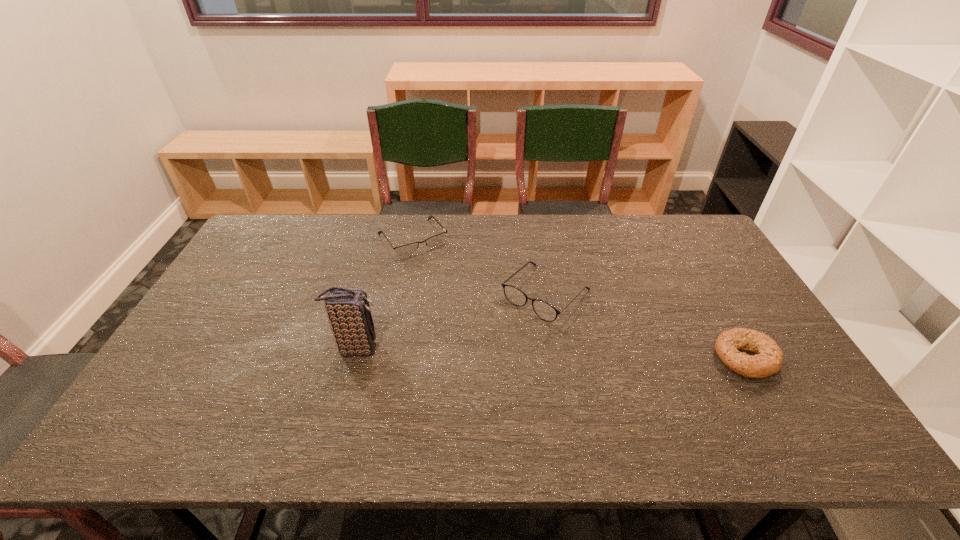
Where is `clutch bag`? clutch bag is located at coordinates (348, 310).

You are a GUI agent. You are given a task and a screenshot of the screen. Output one action in this format:
    pyautogui.click(x=<x>, y=<y>)
    Task: Click on the bagel
    The height and width of the screenshot is (540, 960).
    Given the screenshot: What is the action you would take?
    pyautogui.click(x=768, y=360)

Locate an element on the screen. The image size is (960, 540). the third object from left to right is located at coordinates (544, 310).

Identify the location of the taller spectacles. (544, 310).

This screenshot has height=540, width=960. In order to click on the farthest object in this screenshot , I will do `click(406, 250)`.

The image size is (960, 540). Identify the location of the shorter spectacles. (406, 250).

Identify the location of free space located 0.370m with the zip open on the tallest object. (519, 348).

Locate an element on the screen. vacant area located 0.100m on the left of the rightmost object is located at coordinates (677, 357).

The image size is (960, 540). In order to click on free space located on the front-facing side of the second farthest object in this screenshot , I will do `click(444, 400)`.

You are a GUI agent. You are given a task and a screenshot of the screen. Output one action in this format:
    pyautogui.click(x=<x>, y=<y>)
    Task: Click on the vacant region located on the front-facing side of the second farthest object
    The height and width of the screenshot is (540, 960).
    Given the screenshot: What is the action you would take?
    pyautogui.click(x=490, y=353)